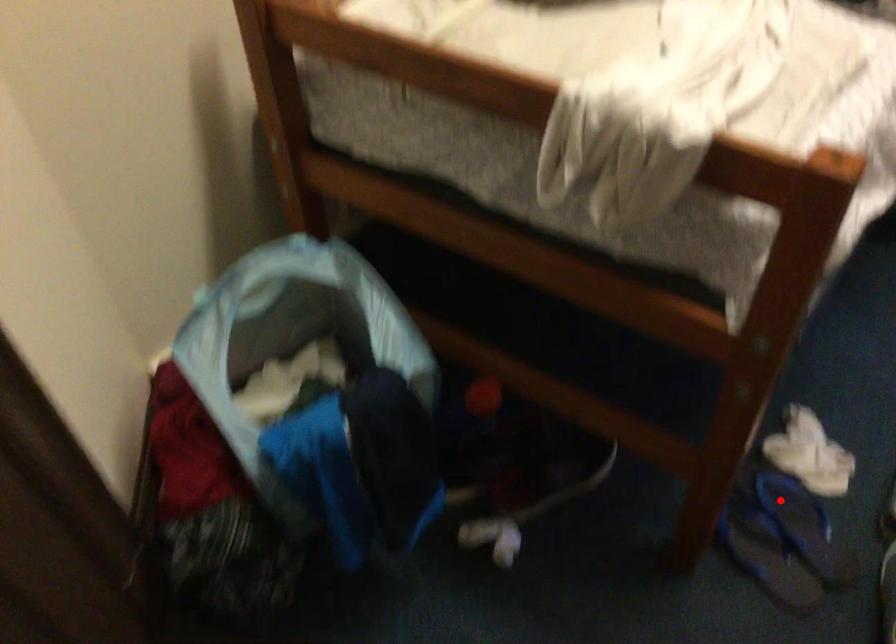
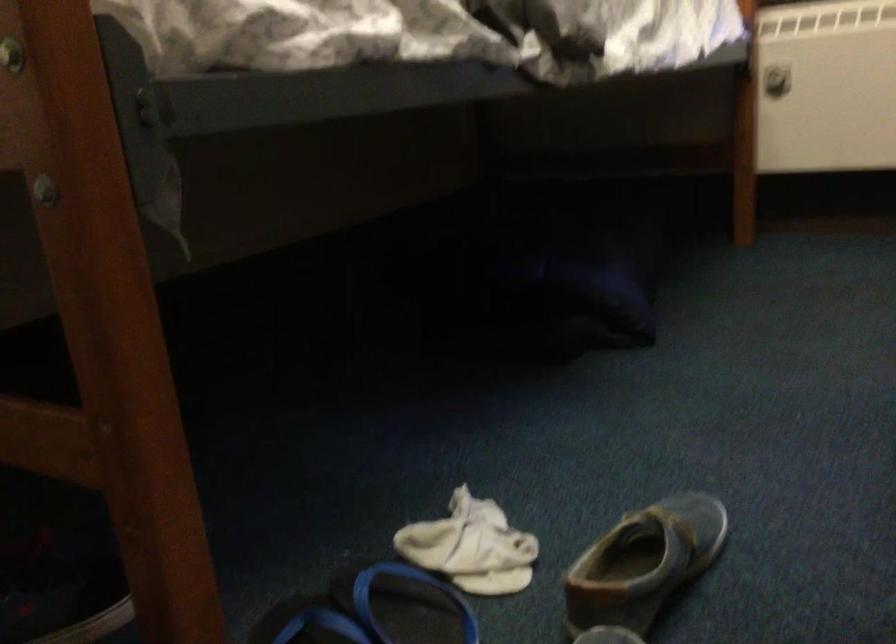
Question: I am providing you with two images of the same scene from different viewpoints. In image1, a red point is highlighted. Considering the same 3D point in image2, which of the following is correct?

Choices:
 (A) It is closer
 (B) It is farther

Answer: (A)